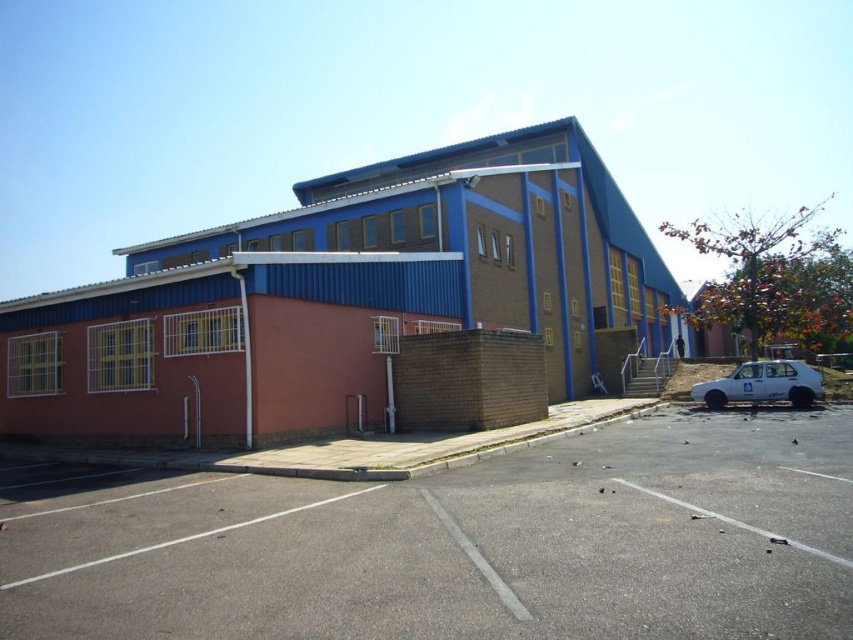
You are standing at the base of the multi story building and looking towards the roof. There are two points marked on the building wall. The first point is at coordinate point [677,538] and the second point is at coordinate point [746,374]. Which point is closer to you?

Point [677,538] is in front of point [746,374], so the first point is closer to you.

You are a delivery driver who needs to park your white matte car at lower right as close as possible to the gray asphalt parking lot at center. How far will your car be from the parking lot after parking?

The distance between the gray asphalt parking lot at center and the white matte car at lower right is 49.27 feet, so after parking, the car will be 49.27 feet away from the parking lot.

You are a delivery driver who needs to park your white matte car at lower right in the gray asphalt parking lot at center. Can you fit your car into the parking space?

The gray asphalt parking lot at center might be wider than white matte car at lower right, so there is a possibility that the car can fit, but it is uncertain due to the comparative width.